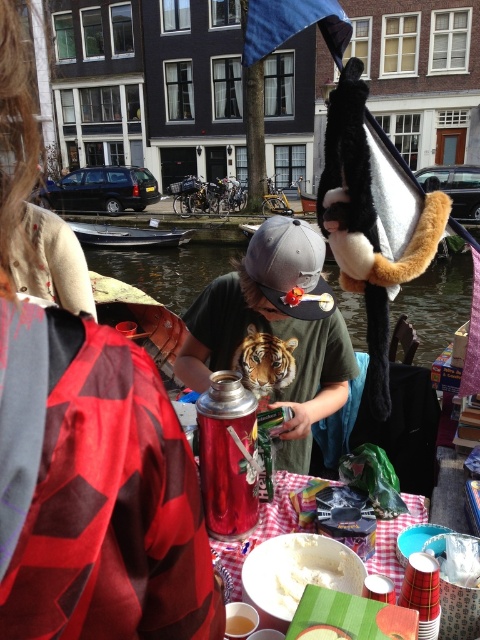
Is point (276, 340) farther from viewer compared to point (213, 545)?

Yes.

Looking at this image, between metallic tiger head at center and checkered fabric tablecloth at lower center, which one is positioned higher?

metallic tiger head at center

Is point (305, 260) closer to camera compared to point (384, 536)?

No, it is behind (384, 536).

Identify the location of metallic tiger head at center. Image resolution: width=480 pixels, height=640 pixels. (275, 333).

Who is shorter, flannel shirt at upper left or smooth yellowish paste at center?

smooth yellowish paste at center

Does flannel shirt at upper left appear over smooth yellowish paste at center?

Correct, flannel shirt at upper left is located above smooth yellowish paste at center.

Describe the element at coordinates (86, 452) in the screenshot. I see `flannel shirt at upper left` at that location.

Locate an element on the screen. flannel shirt at upper left is located at coordinates (86, 452).

Is white matte bowl at center wider than orange fur tiger at center?

No, white matte bowl at center is not wider than orange fur tiger at center.

You are a GUI agent. You are given a task and a screenshot of the screen. Output one action in this format:
    pyautogui.click(x=<x>, y=<y>)
    Task: Click on the white matte bowl at center
    Image resolution: width=480 pixels, height=640 pixels.
    Given the screenshot: What is the action you would take?
    pyautogui.click(x=313, y=566)